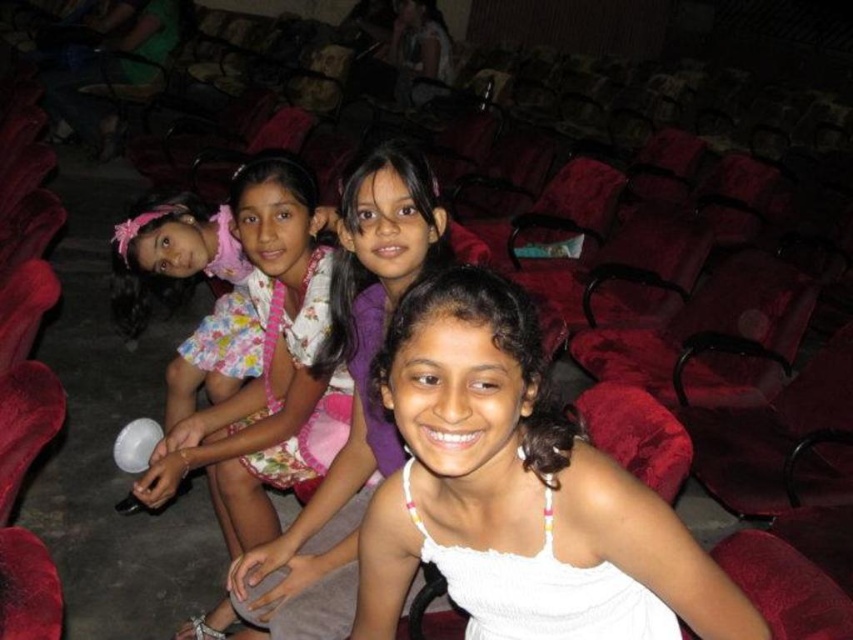
Question: Does white fabric dress at center have a greater width compared to floral fabric dress at center?

Choices:
 (A) yes
 (B) no

Answer: (A)

Question: Based on their relative distances, which object is nearer to the white cotton dress at center?

Choices:
 (A) floral fabric dress at center
 (B) white fabric dress at center

Answer: (A)

Question: Is the position of floral fabric dress at center less distant than that of smooth skin woman at upper center?

Choices:
 (A) no
 (B) yes

Answer: (B)

Question: Which of these objects is positioned closest to the smooth skin woman at upper center?

Choices:
 (A) floral fabric dress at center
 (B) white cotton dress at center

Answer: (A)

Question: Does floral fabric dress at center appear on the right side of white cotton dress at center?

Choices:
 (A) no
 (B) yes

Answer: (A)

Question: Which object is closer to the camera taking this photo?

Choices:
 (A) smooth skin woman at upper center
 (B) white fabric dress at center
 (C) floral fabric dress at center

Answer: (B)